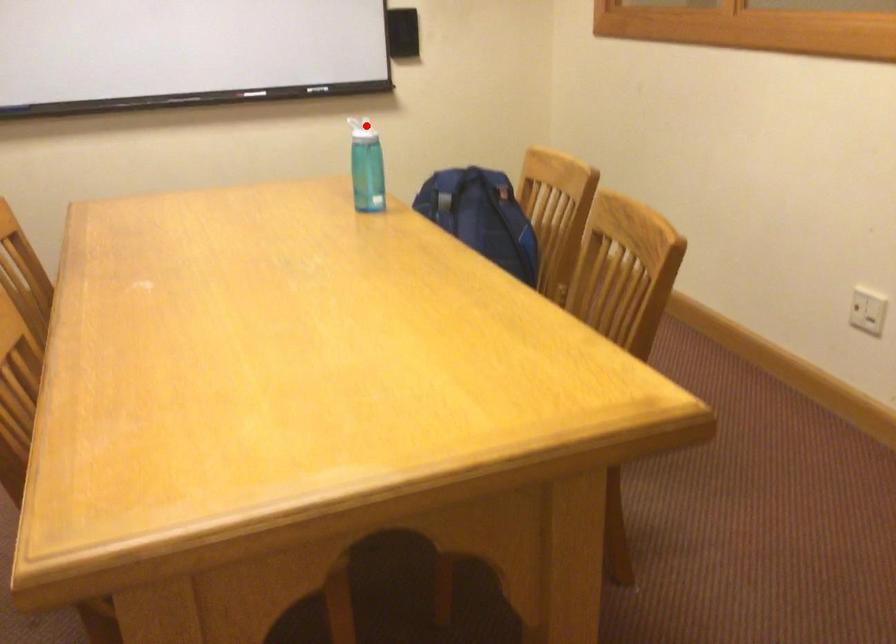
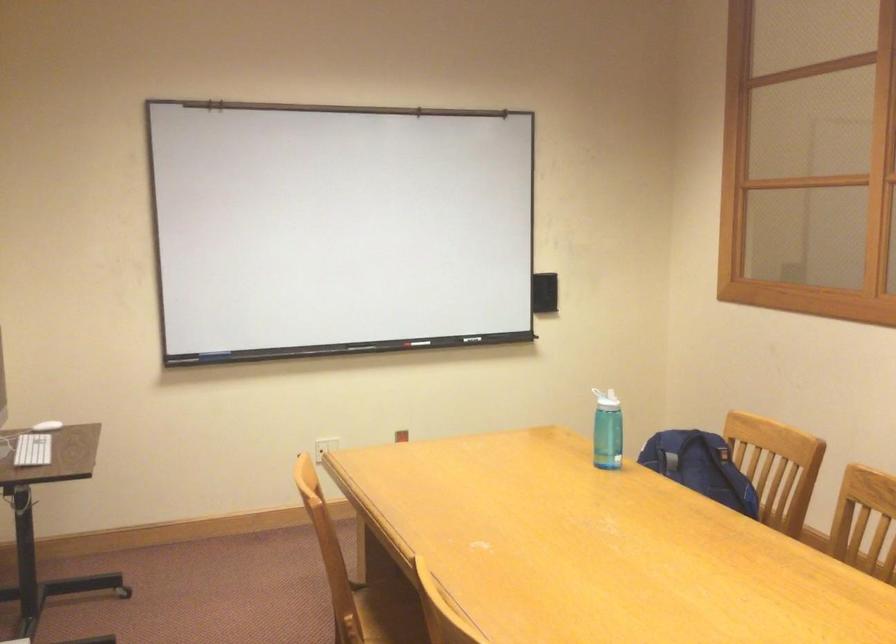
Question: I am providing you with two images of the same scene from different viewpoints. Given a red point in image1, look at the same physical point in image2. Is it:

Choices:
 (A) Closer to the viewpoint
 (B) Farther from the viewpoint

Answer: (B)